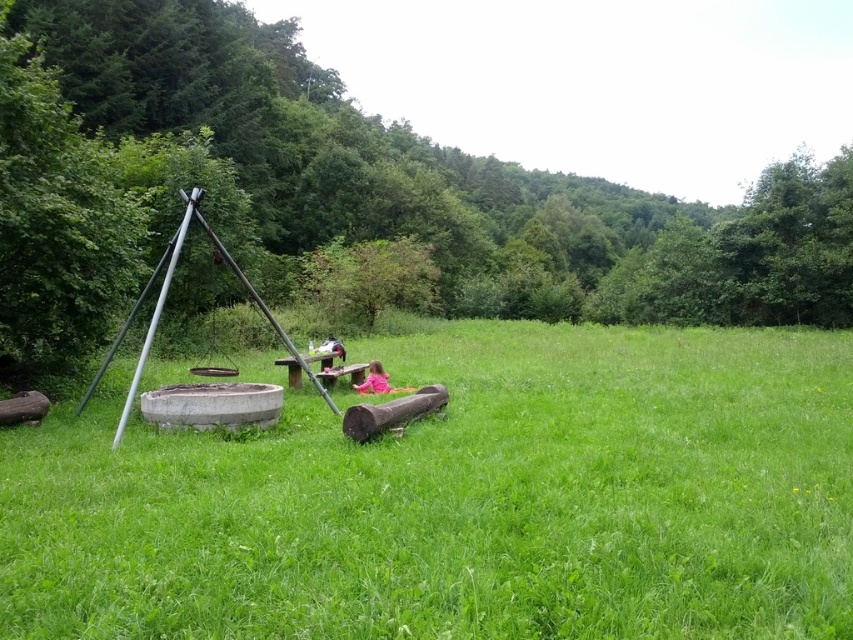
You are a parent looking for your child in a playground. You see green grass at center and pink fabric at center. Which object is located to the right of the other?

The green grass at center is to the right of pink fabric at center.

You are a parent looking for your child in the green field. You see the green grass at center and the pink fabric at center. Which object is bigger in size?

The green grass at center is larger in size than the pink fabric at center.

You are standing at the center of the image. Which direction should you move to reach the green grass at center?

The green grass at center is located at point coordinates 0.783 on the x axis and 0.544 on the y axis. Since you are already at the center of the image, you are already standing on the green grass at center.